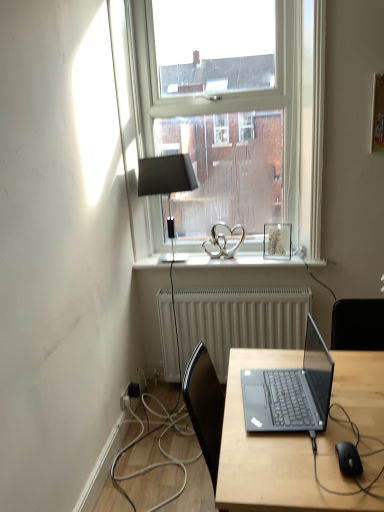
Identify the location of free space above white glossy window sill at center (from a real-world perspective). (234, 255).